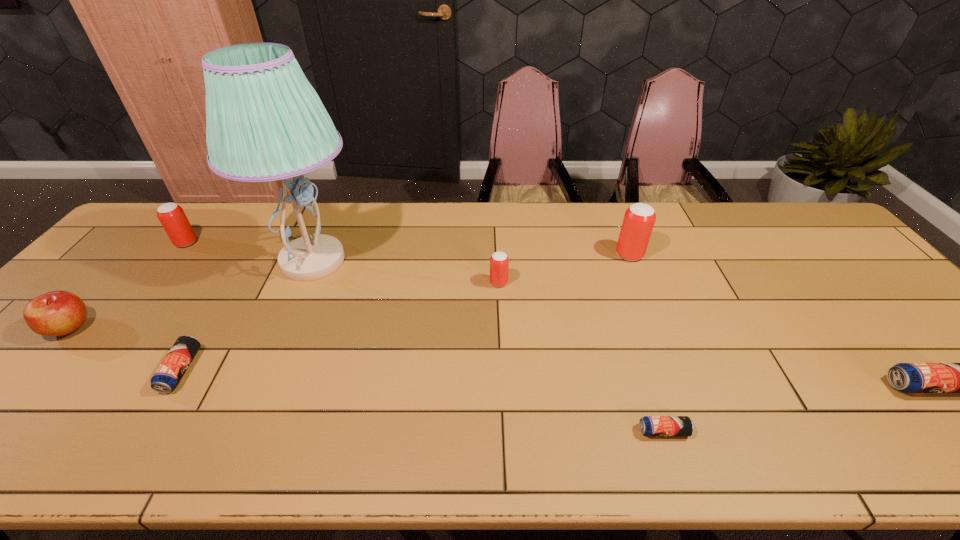
Find the location of a particular element. This screenshot has width=960, height=540. free space located on the left of the nearest object is located at coordinates (528, 431).

Find the location of a particular element. This screenshot has height=540, width=960. lamp that is at the far edge is located at coordinates pos(265,122).

Locate an element on the screen. The height and width of the screenshot is (540, 960). beer can present at the far edge is located at coordinates (172, 217).

You are a GUI agent. You are given a task and a screenshot of the screen. Output one action in this format:
    pyautogui.click(x=<x>, y=<y>)
    Task: Click on the object situated at the near edge
    Image resolution: width=960 pixels, height=540 pixels.
    Given the screenshot: What is the action you would take?
    pyautogui.click(x=649, y=425)

Identify the location of object at the left edge. point(57,313).

In the image, there is a desktop. What are the coordinates of `vacant space at the far edge` in the screenshot? It's located at (278, 225).

At what (x,y) coordinates should I click in order to perform the action: click on vacant area at the near edge. Please return your answer as a coordinate pair (x, y). This screenshot has height=540, width=960. Looking at the image, I should click on (240, 437).

Locate an element on the screen. This screenshot has width=960, height=540. vacant space at the left edge is located at coordinates (119, 247).

At what (x,y) coordinates should I click in order to perform the action: click on vacant point located between the nearest blue beer can and the tallest beer can. Please return your answer as a coordinate pair (x, y). The width and height of the screenshot is (960, 540). Looking at the image, I should click on 646,343.

The width and height of the screenshot is (960, 540). I want to click on vacant area that lies between the lamp and the second red beer can from left to right, so click(406, 272).